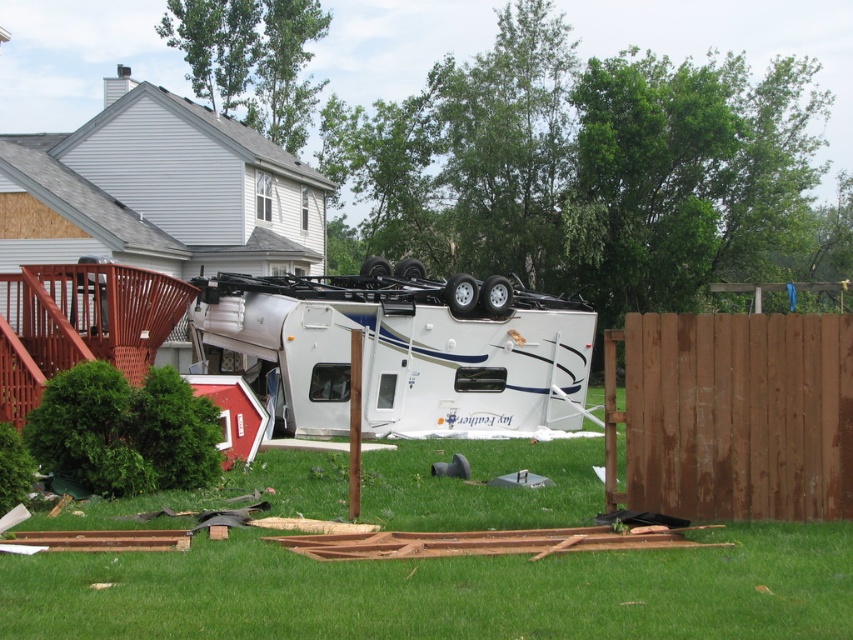
Can you confirm if green grass at center is shorter than white glossy trailer truck at center?

Indeed, green grass at center has a lesser height compared to white glossy trailer truck at center.

Does green grass at center have a lesser width compared to white glossy trailer truck at center?

Incorrect, green grass at center's width is not less than white glossy trailer truck at center's.

What do you see at coordinates (444, 592) in the screenshot? I see `green grass at center` at bounding box center [444, 592].

Find the location of a particular element. This screenshot has width=853, height=640. green grass at center is located at coordinates (444, 592).

In the scene shown: Can you confirm if white glossy trailer truck at center is wider than brown wooden fence at right?

In fact, white glossy trailer truck at center might be narrower than brown wooden fence at right.

Between point (386, 384) and point (773, 477), which one is positioned in front?

Point (773, 477) is in front.

Where is `white glossy trailer truck at center`? The image size is (853, 640). white glossy trailer truck at center is located at coordinates (408, 349).

Is green grass at center wider than brown wooden fence at right?

Indeed, green grass at center has a greater width compared to brown wooden fence at right.

You are a GUI agent. You are given a task and a screenshot of the screen. Output one action in this format:
    pyautogui.click(x=<x>, y=<y>)
    Task: Click on the green grass at center
    
    Given the screenshot: What is the action you would take?
    pyautogui.click(x=444, y=592)